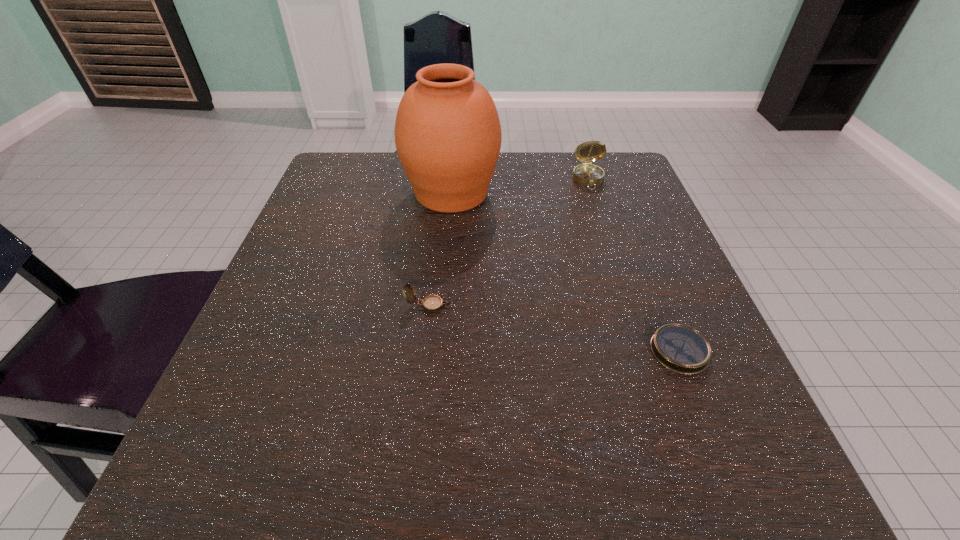
Image resolution: width=960 pixels, height=540 pixels. I want to click on vacant space that satisfies the following two spatial constraints: 1. on the face of the nearest compass; 2. on the right side of the third tallest object, so click(423, 351).

Identify the location of free space that satisfies the following two spatial constraints: 1. on the face of the second nearest compass; 2. on the right side of the nearest compass. The height and width of the screenshot is (540, 960). (423, 351).

In order to click on vacant position in the image that satisfies the following two spatial constraints: 1. with the dial facing the second tallest object; 2. on the face of the second tallest compass in this screenshot , I will do `click(630, 306)`.